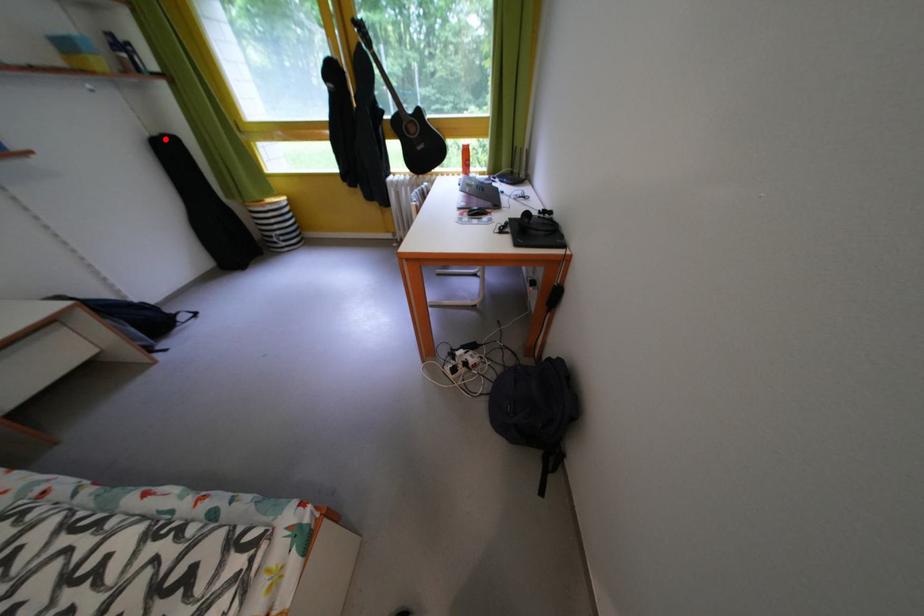
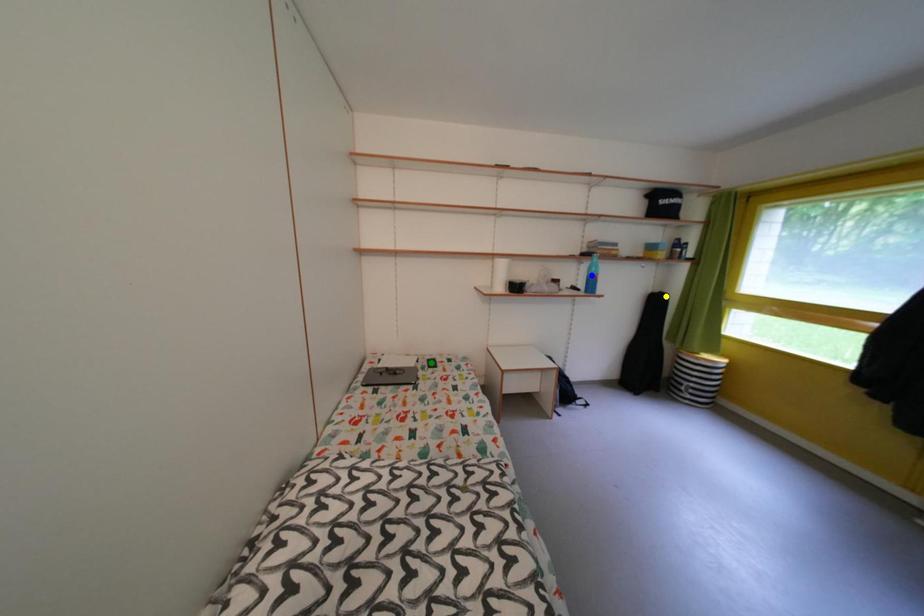
Question: I am providing you with two images of the same scene from different viewpoints. A red point is marked on the first image. You are given multiple points on the second image. Which point in image 2 represents the same 3d spot as the red point in image 1?

Choices:
 (A) yellow point
 (B) blue point
 (C) green point

Answer: (A)